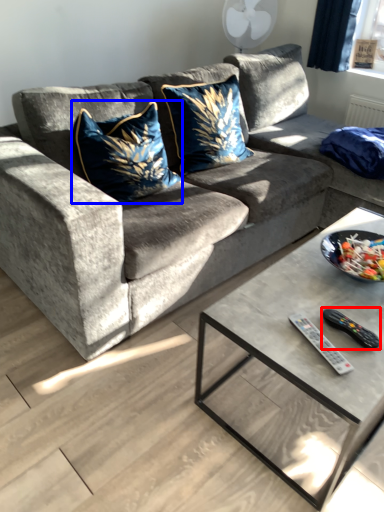
Question: Which object is closer to the camera taking this photo, remote (highlighted by a red box) or throw pillow (highlighted by a blue box)?

Choices:
 (A) remote
 (B) throw pillow

Answer: (A)